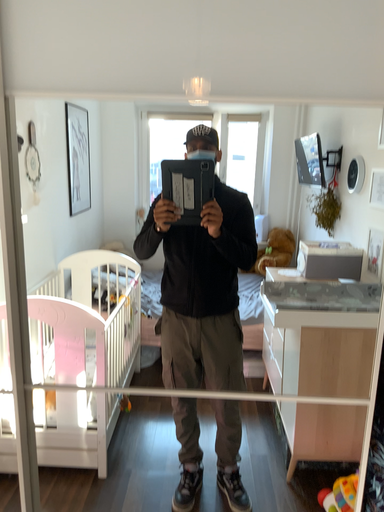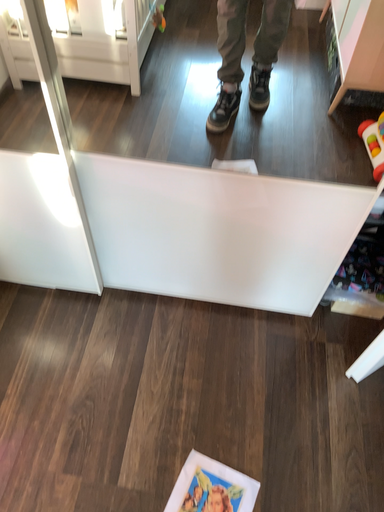
Question: How did the camera likely rotate when shooting the video?

Choices:
 (A) rotated downward
 (B) rotated upward

Answer: (A)